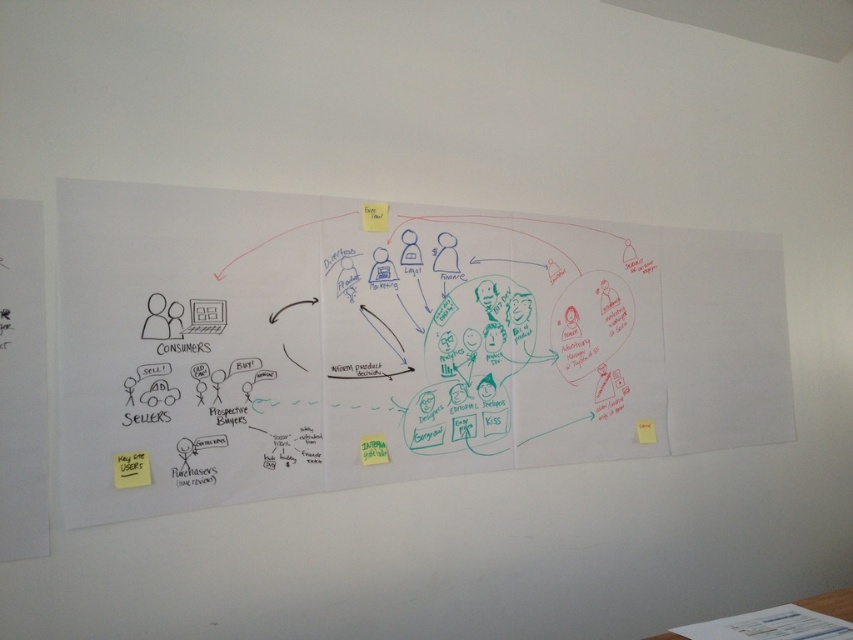
You are analyzing the flowchart on the whiteboard and notice two points marked at coordinates point (515,333) and point (372,449). Which point is closer to the viewer?

Point (515,333) is further to the viewer than point (372,449), so point (372,449) is closer to the viewer.

What is the 2D coordinate of the white paper at center in the image?

The white paper at center is located at the coordinate point of (x=392, y=342).

You are analyzing the flowchart on the whiteboard. There are two points marked on the diagram at coordinates point (583, 348) and point (384, 212). Which point is closer to the viewer?

Point (583, 348) is further to the viewer than point (384, 212), so the closer point to the viewer is point (384, 212).